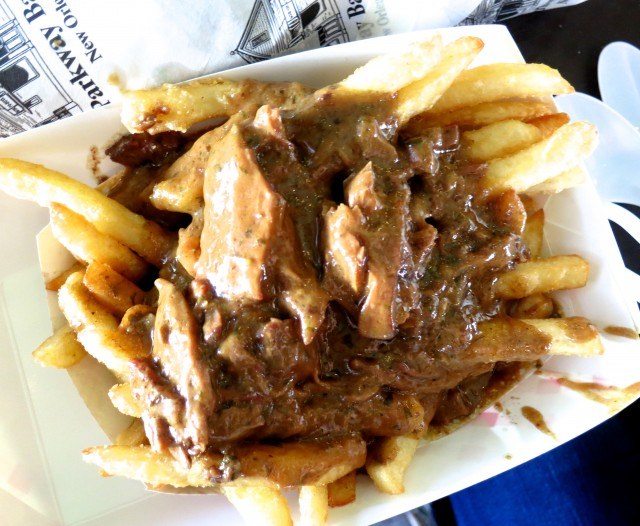
Identify the location of spoon. The width and height of the screenshot is (640, 526). (633, 105).